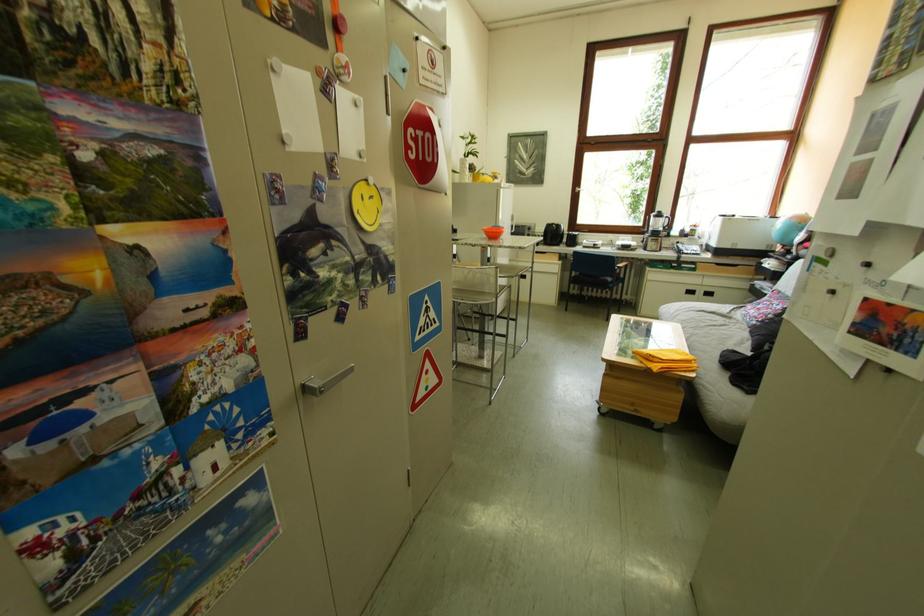
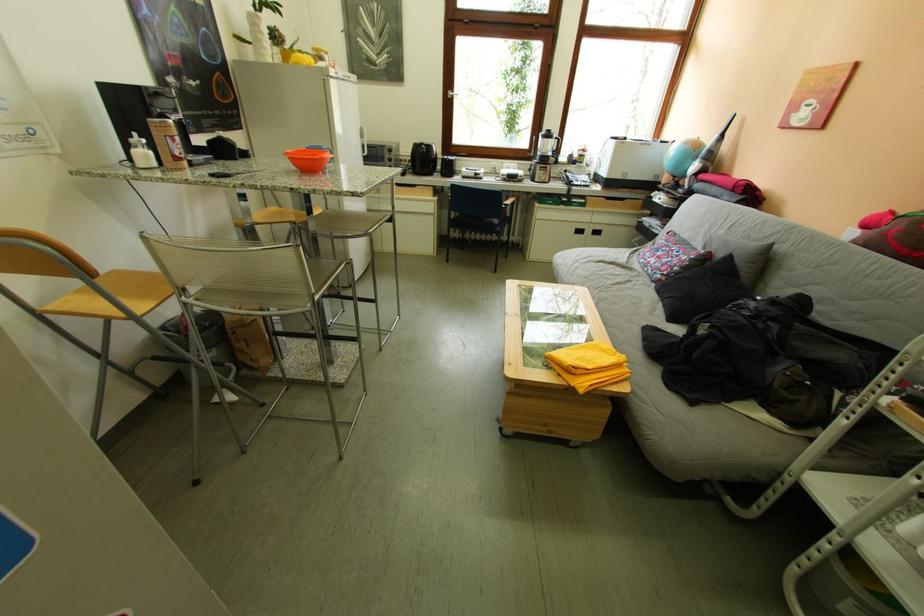
Locate, in the second image, the point that corresponds to pixel 621 293 in the first image.

(507, 238)